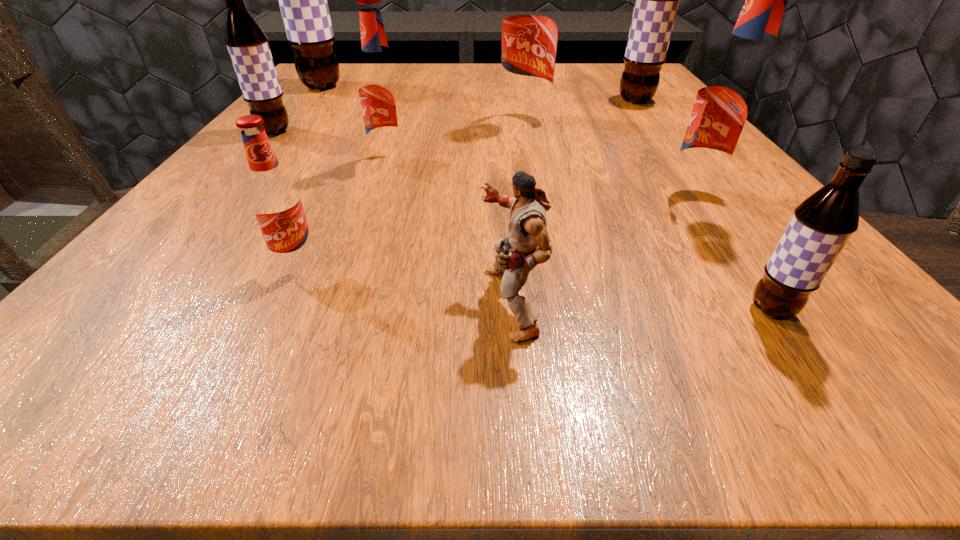
Where is `red root beer that can be found as the fourth closest to the puncher`? red root beer that can be found as the fourth closest to the puncher is located at coordinates (530, 20).

The image size is (960, 540). I want to click on red root beer that is the third closest one to the third biggest brown root beer, so (x=530, y=20).

At what (x,y) coordinates should I click in order to perform the action: click on vacant region that satisfies the following two spatial constraints: 1. on the back side of the second red root beer from right to left; 2. on the right side of the fourth root beer from left to right. Please return your answer as a coordinate pair (x, y). The image size is (960, 540). Looking at the image, I should click on (404, 122).

Locate an element on the screen. Image resolution: width=960 pixels, height=540 pixels. free space in the image that satisfies the following two spatial constraints: 1. on the back side of the second biggest brown root beer; 2. on the right side of the fifth nearest object is located at coordinates (411, 100).

In order to click on vacant region that satisfies the following two spatial constraints: 1. on the front-facing side of the puncher; 2. on the left side of the nearest brown root beer in this screenshot , I will do `click(511, 310)`.

In order to click on blank area in the image that satisfies the following two spatial constraints: 1. on the front-facing side of the puncher; 2. on the back side of the smallest brown root beer in this screenshot , I will do `click(511, 310)`.

The image size is (960, 540). Find the location of `free region that satisfies the following two spatial constraints: 1. on the back side of the nearest brown root beer; 2. on the left side of the third farthest red root beer`. free region that satisfies the following two spatial constraints: 1. on the back side of the nearest brown root beer; 2. on the left side of the third farthest red root beer is located at coordinates (692, 197).